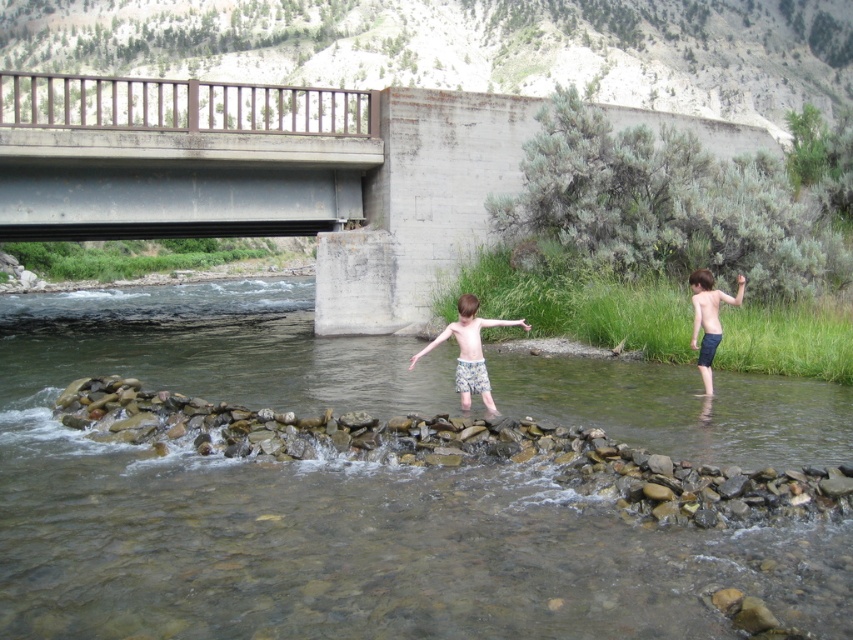
Who is higher up, clear water at center or dark blue shorts at right?

dark blue shorts at right

Who is more distant from viewer, (25, 305) or (709, 292)?

Point (25, 305)

Which is in front, point (422, 560) or point (701, 346)?

Positioned in front is point (422, 560).

Where is `clear water at center`? The image size is (853, 640). clear water at center is located at coordinates (326, 500).

From the picture: Who is higher up, light blue shorts at center or dark blue shorts at right?

dark blue shorts at right is higher up.

You are a GUI agent. You are given a task and a screenshot of the screen. Output one action in this format:
    pyautogui.click(x=<x>, y=<y>)
    Task: Click on the light blue shorts at center
    
    Given the screenshot: What is the action you would take?
    pyautogui.click(x=469, y=349)

The image size is (853, 640). I want to click on light blue shorts at center, so click(x=469, y=349).

Measure the distance between metallic gray bridge at upper center and dark blue shorts at right.

metallic gray bridge at upper center and dark blue shorts at right are 23.16 meters apart from each other.

Is metallic gray bridge at upper center smaller than dark blue shorts at right?

Actually, metallic gray bridge at upper center might be larger than dark blue shorts at right.

Between point (276, 205) and point (705, 332), which one is positioned behind?

The point (276, 205) is more distant.

Where is `metallic gray bridge at upper center`? metallic gray bridge at upper center is located at coordinates (178, 157).